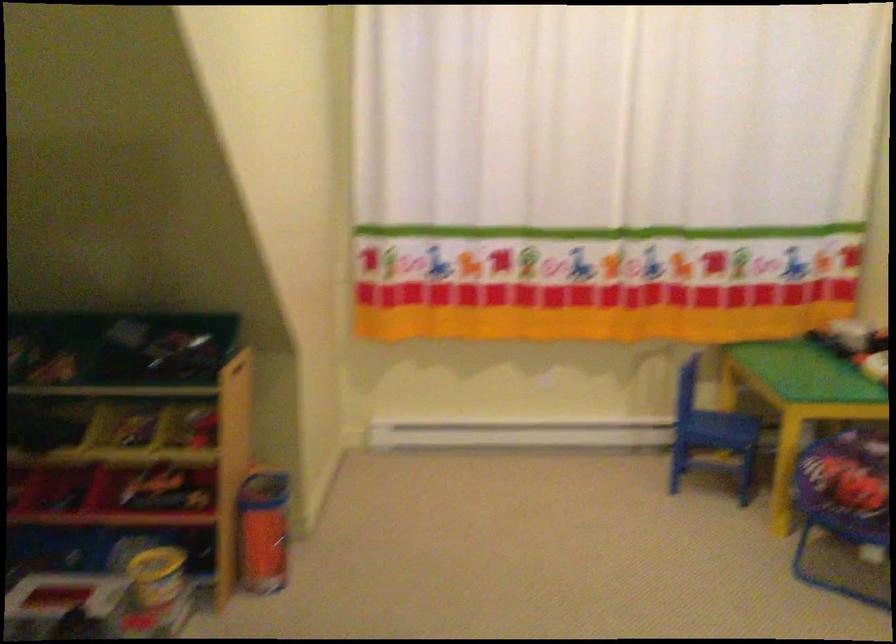
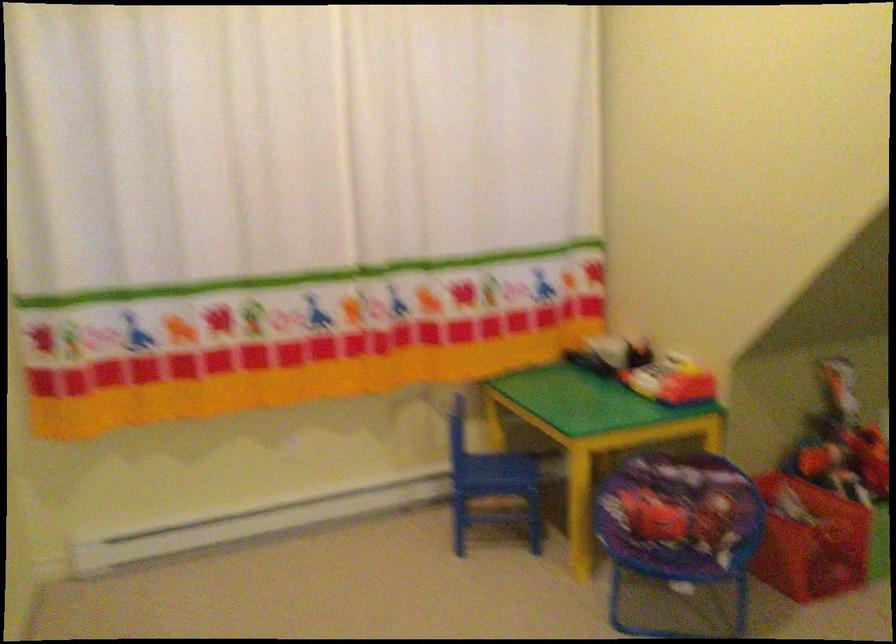
Question: Which direction would the cameraman need to move to produce the second image? Reply with the corresponding letter.

Choices:
 (A) Left
 (B) Right
 (C) Forward
 (D) Backward

Answer: (C)